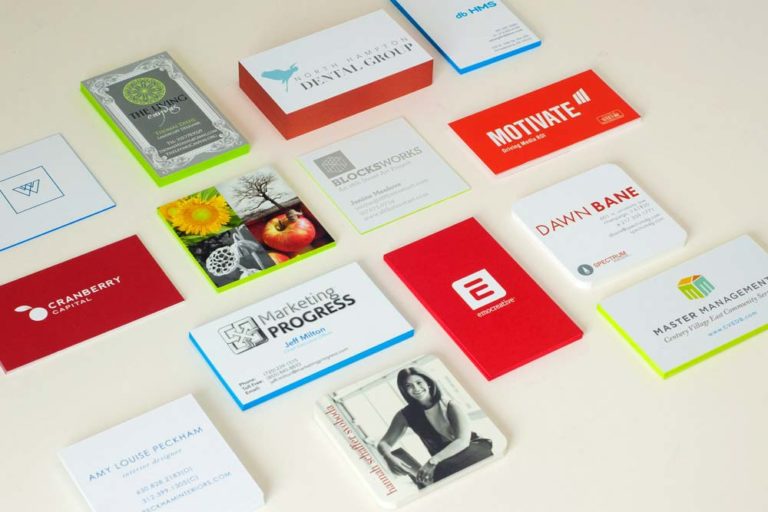
Where is `shadows on counter`? This screenshot has width=768, height=512. shadows on counter is located at coordinates (73, 28), (710, 50).